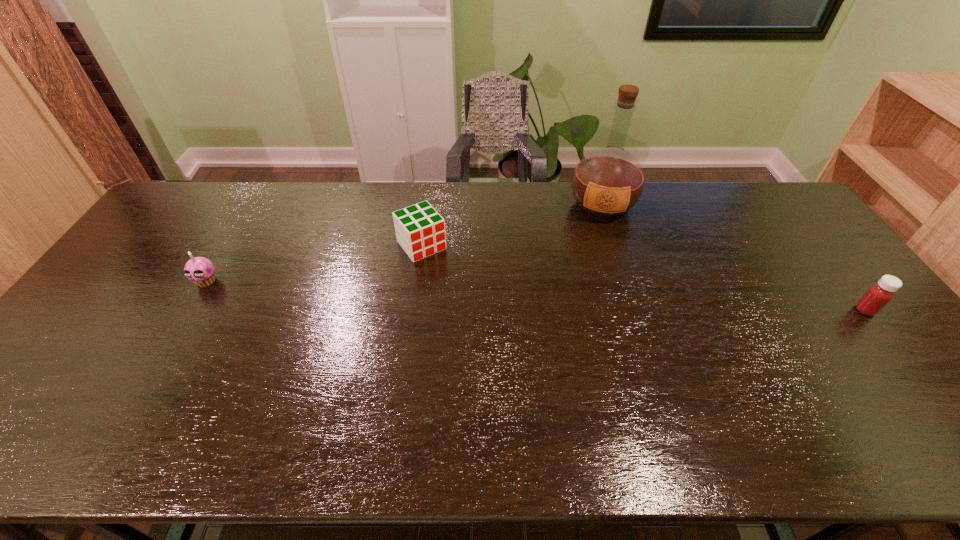
Where is `vacant area situated 0.250m on the front label of the farthest object`? The width and height of the screenshot is (960, 540). vacant area situated 0.250m on the front label of the farthest object is located at coordinates (599, 280).

Locate an element on the screen. The width and height of the screenshot is (960, 540). vacant space located on the front label of the farthest object is located at coordinates (597, 311).

You are a GUI agent. You are given a task and a screenshot of the screen. Output one action in this format:
    pyautogui.click(x=<x>, y=<y>)
    Task: Click on the vacant space located 0.340m on the front label of the farthest object
    Image resolution: width=960 pixels, height=540 pixels.
    Given the screenshot: What is the action you would take?
    pyautogui.click(x=598, y=303)

This screenshot has width=960, height=540. I want to click on vacant space located 0.240m on the red face of the cube, so click(x=475, y=311).

Where is `vacant space located 0.340m on the red face of the cube`? vacant space located 0.340m on the red face of the cube is located at coordinates (495, 336).

At what (x,y) coordinates should I click in order to perform the action: click on vacant space located on the red face of the cube. Please return your answer as a coordinate pair (x, y). Looking at the image, I should click on (458, 291).

Identify the location of object located in the far edge section of the desktop. The image size is (960, 540). (607, 182).

You are a GUI agent. You are given a task and a screenshot of the screen. Output one action in this format:
    pyautogui.click(x=<x>, y=<y>)
    Task: Click on the object positioned at the right edge
    The image size is (960, 540).
    Given the screenshot: What is the action you would take?
    pyautogui.click(x=878, y=295)

The width and height of the screenshot is (960, 540). What are the coordinates of `free space at the far edge of the desktop` in the screenshot? It's located at (477, 201).

The width and height of the screenshot is (960, 540). In the image, there is a desktop. Find the location of `vacant space at the near edge`. vacant space at the near edge is located at coordinates (291, 394).